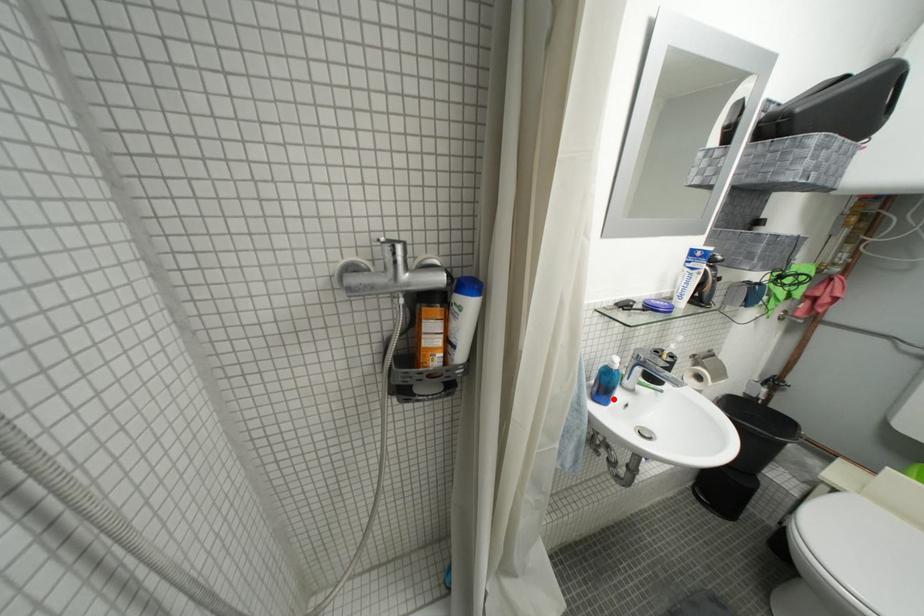
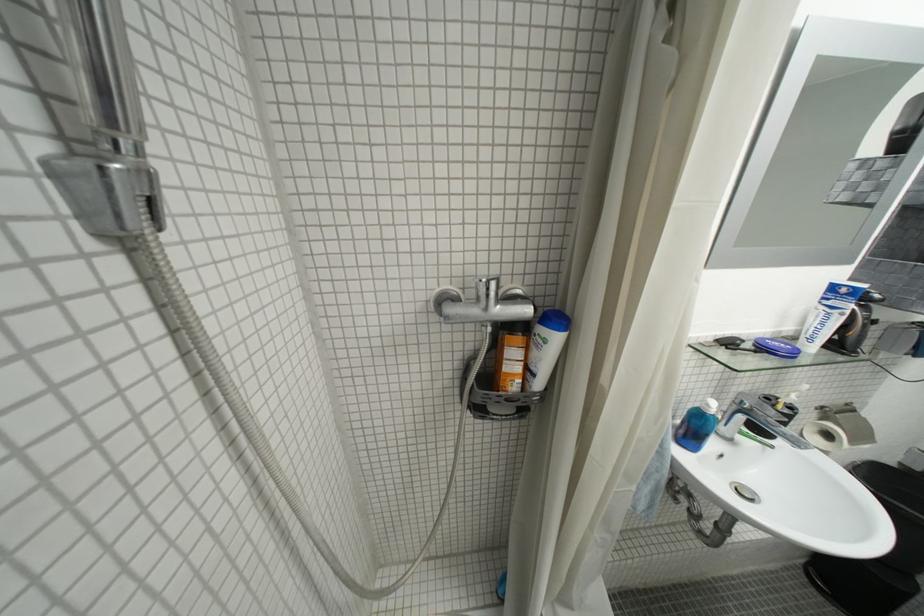
The point at the highlighted location is marked in the first image. Where is the corresponding point in the second image?

(700, 445)